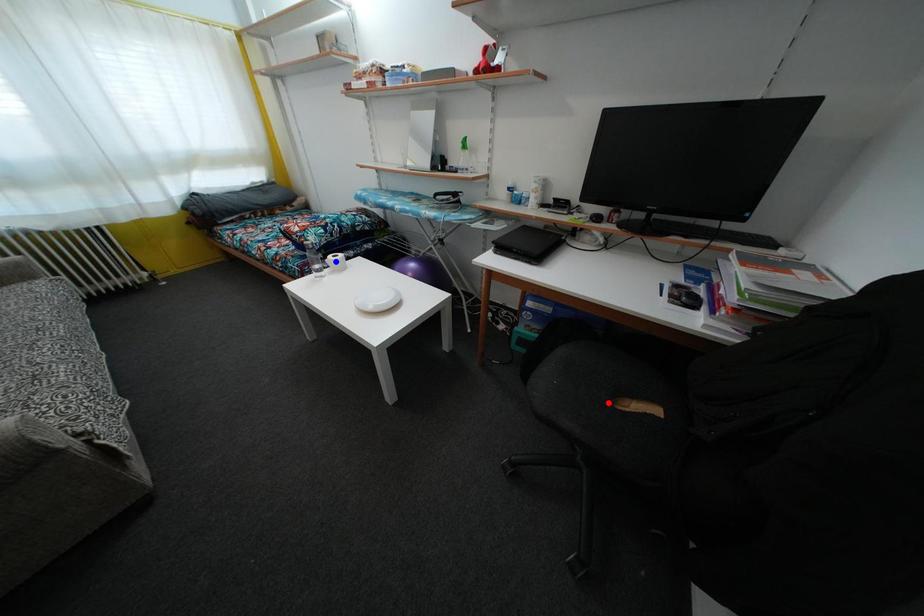
Question: In the image, two points are highlighted. Which point is nearer to the camera? Reply with the corresponding letter.

Choices:
 (A) blue point
 (B) red point

Answer: (B)